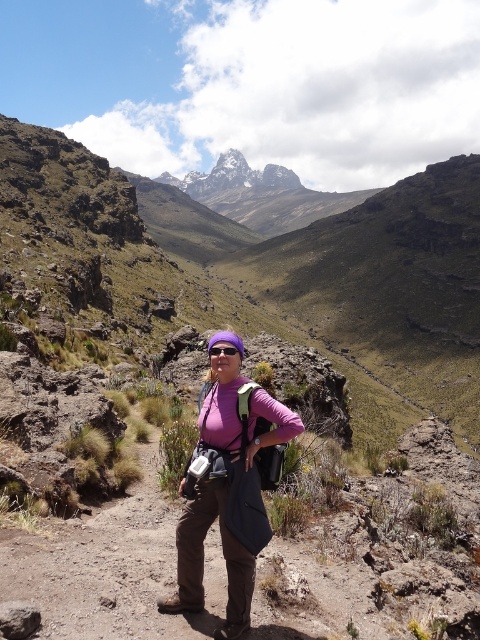
You are a drone operator trying to capture a photo of the hiker from above. You have two points marked on your map, point (x=222, y=188) and point (x=238, y=349). Which point is closer to the camera to ensure the hiker is in focus?

Point (x=222, y=188) is further to the camera than point (x=238, y=349), so point (x=238, y=349) is closer to the camera and will ensure the hiker is in focus.

You are the hiker in the image and want to place a marker at point (237, 598) and another at point (211, 349). Which marker should you place first if you want to follow the trail from the starting point to the end point?

You should place the marker at point (211, 349) first because point (237, 598) is in front of it, meaning the trail goes from point (211, 349) towards point (237, 598).

You are a hiker preparing to take a photo of the pink fabric shirt at center and the purple reflective goggles at center. Which object should you zoom in on to ensure both are clearly visible in the frame?

The pink fabric shirt at center is larger in size than the purple reflective goggles at center, so you should zoom in on the pink fabric shirt at center to ensure both are clearly visible in the frame.